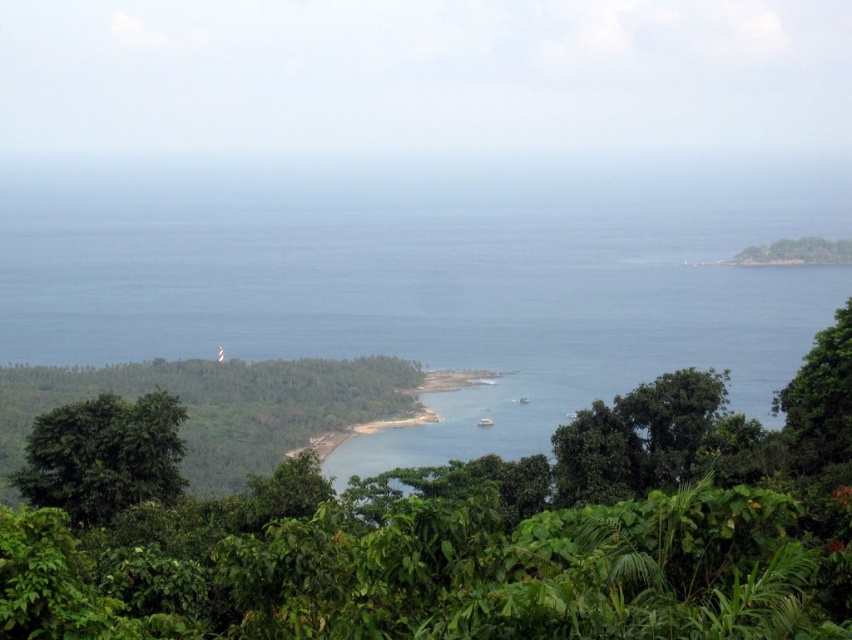
Does green leafy tree at lower left appear over green leafy tree at right?

Actually, green leafy tree at lower left is below green leafy tree at right.

Is point (170, 451) positioned behind point (824, 426)?

Yes, it is behind point (824, 426).

The width and height of the screenshot is (852, 640). I want to click on green leafy tree at lower left, so click(102, 456).

Between point (38, 378) and point (108, 509), which one is positioned behind?

The point (38, 378) is more distant.

Is green leafy tree at center thinner than green leafy tree at lower left?

No, green leafy tree at center is not thinner than green leafy tree at lower left.

Is point (43, 401) more distant than point (147, 424)?

Yes, point (43, 401) is behind point (147, 424).

At what (x,y) coordinates should I click in order to perform the action: click on green leafy tree at center. Please return your answer as a coordinate pair (x, y). Looking at the image, I should click on (217, 406).

In the scene shown: Does blue water at center have a lesser width compared to green leafy jungle at center?

Incorrect, blue water at center's width is not less than green leafy jungle at center's.

Describe the element at coordinates (429, 275) in the screenshot. Image resolution: width=852 pixels, height=640 pixels. I see `blue water at center` at that location.

This screenshot has width=852, height=640. What are the coordinates of `blue water at center` in the screenshot? It's located at (429, 275).